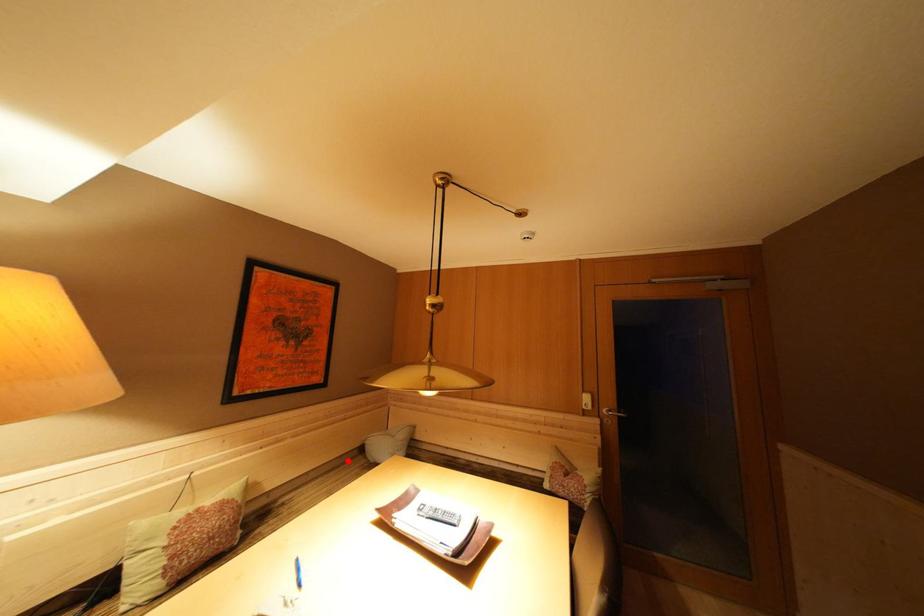
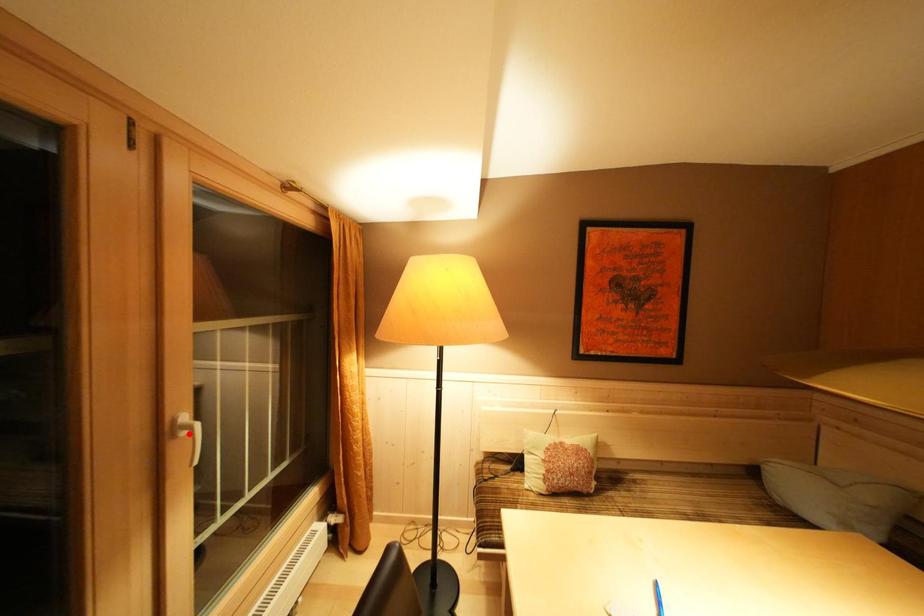
I am providing you with two images of the same scene from different viewpoints. A red point is marked on the first image and another point is marked on the second image. Are the points marked in image1 and image2 representing the same 3D position?

No